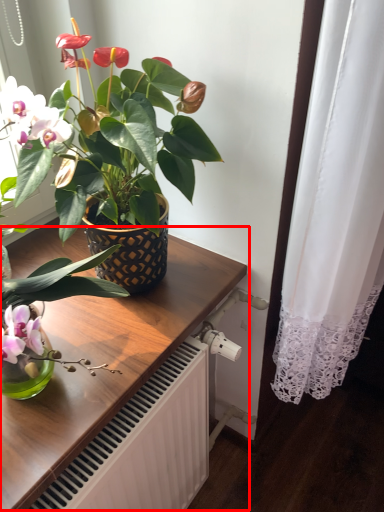
Question: Observing the image, what is the correct spatial positioning of table (annotated by the red box) in reference to houseplant?

Choices:
 (A) right
 (B) left

Answer: (B)